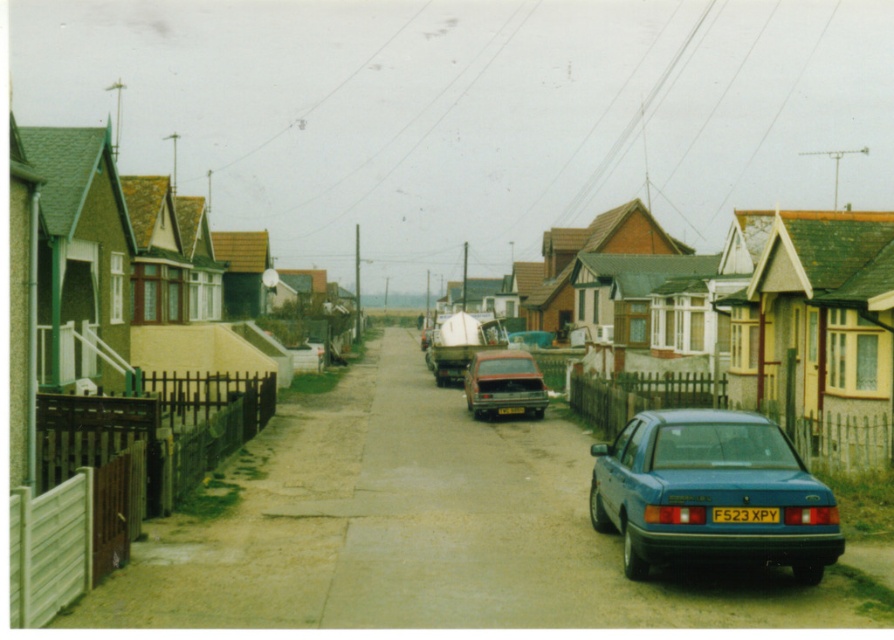
Does matte white boat at center have a lesser width compared to yellow matte license plate at center?

No.

Measure the distance between matte white boat at center and camera.

matte white boat at center is 128.01 feet away from camera.

Is point (471, 355) more distant than point (757, 508)?

Yes, it is.

The width and height of the screenshot is (894, 640). I want to click on matte white boat at center, so click(x=460, y=342).

Between point (469, 371) and point (464, 360), which one is positioned in front?

Positioned in front is point (469, 371).

Does matte red car at center appear on the left side of matte white boat at center?

In fact, matte red car at center is to the right of matte white boat at center.

Locate an element on the screen. The height and width of the screenshot is (640, 894). matte red car at center is located at coordinates (503, 381).

Can you confirm if brown wooden fence at left is wider than blue metallic sedan at center?

Yes.

Does brown wooden fence at left have a larger size compared to blue metallic sedan at center?

Yes.

Does point (418, 467) come farther from viewer compared to point (626, 534)?

That is True.

Find the location of a particular element. The image size is (894, 640). brown wooden fence at left is located at coordinates (426, 531).